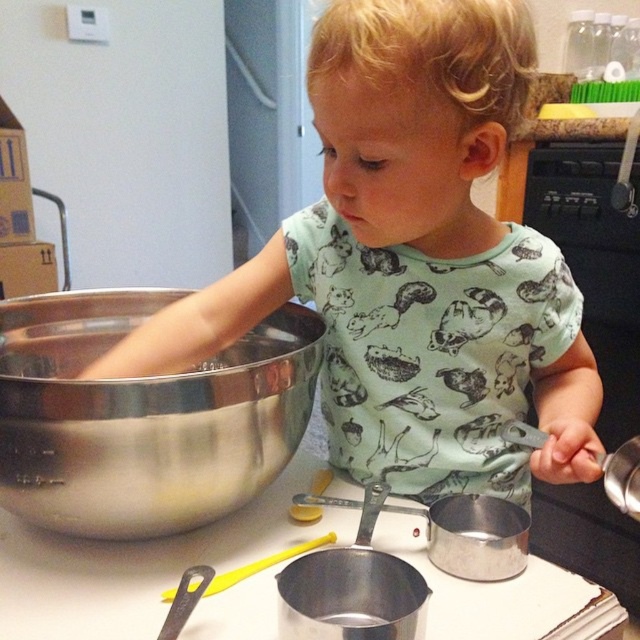
Question: Considering the relative positions of green printed shirt at center and shiny metallic bowl at center in the image provided, where is green printed shirt at center located with respect to shiny metallic bowl at center?

Choices:
 (A) left
 (B) right

Answer: (B)

Question: Which point is farther from the camera taking this photo?

Choices:
 (A) (227, 337)
 (B) (320, 324)

Answer: (B)

Question: Is green printed shirt at center positioned behind shiny metallic bowl at center?

Choices:
 (A) no
 (B) yes

Answer: (B)

Question: Is green printed shirt at center smaller than shiny metallic bowl at center?

Choices:
 (A) yes
 (B) no

Answer: (B)